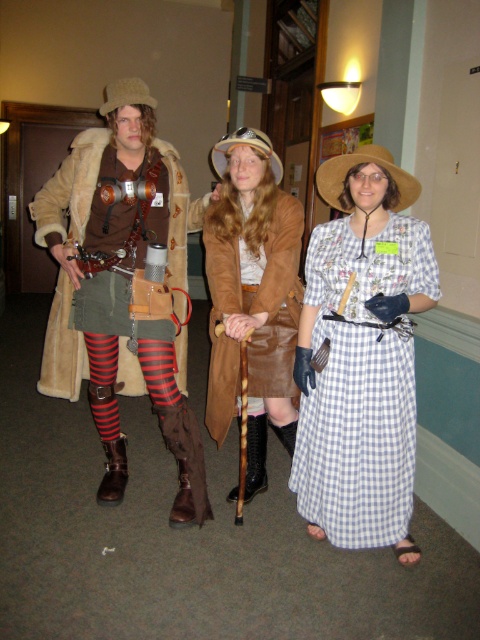
Question: Which point appears farthest from the camera in this image?

Choices:
 (A) (143, 296)
 (B) (217, 272)
 (C) (324, 508)

Answer: (A)

Question: Which of the following is the closest to the observer?

Choices:
 (A) striped wool tights at center
 (B) white checkered fabric dress at center

Answer: (B)

Question: Is striped wool tights at center further to the viewer compared to white checkered fabric dress at center?

Choices:
 (A) no
 (B) yes

Answer: (B)

Question: Does striped wool tights at center appear on the right side of white checkered fabric dress at center?

Choices:
 (A) no
 (B) yes

Answer: (A)

Question: From the image, what is the correct spatial relationship of striped wool tights at center in relation to brown suede coat at center?

Choices:
 (A) left
 (B) right

Answer: (A)

Question: Which point is farther to the camera?

Choices:
 (A) (97, 282)
 (B) (240, 285)
 (C) (356, 250)

Answer: (A)